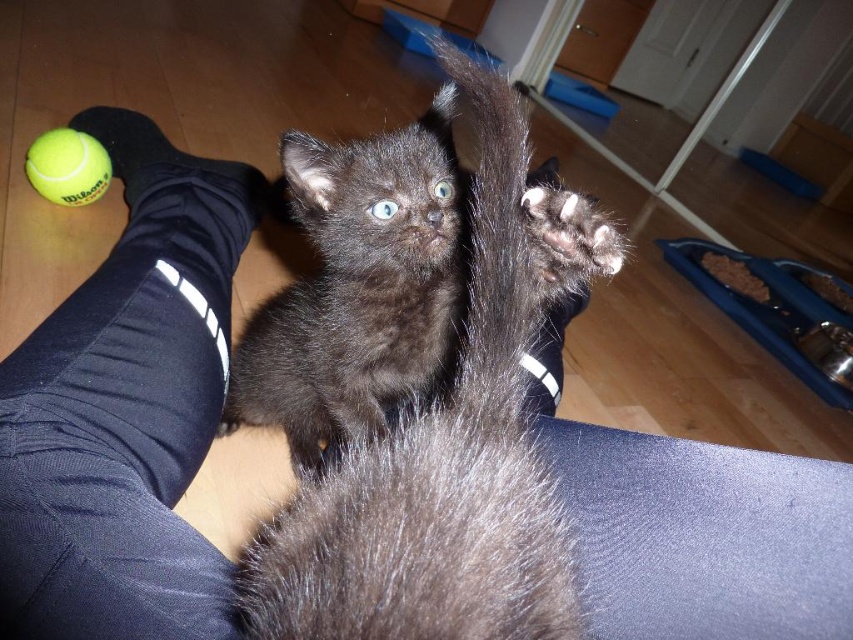
Question: Does black fur cat at center appear on the left side of green rubber tennis ball at lower left?

Choices:
 (A) no
 (B) yes

Answer: (A)

Question: Which object appears closest to the camera in this image?

Choices:
 (A) black fur cat at center
 (B) green rubber tennis ball at lower left

Answer: (A)

Question: Is black fur cat at center positioned behind green rubber tennis ball at lower left?

Choices:
 (A) no
 (B) yes

Answer: (A)

Question: Among these points, which one is farthest from the camera?

Choices:
 (A) [49, 188]
 (B) [448, 554]

Answer: (A)

Question: Is black fur cat at center to the left of green rubber tennis ball at lower left from the viewer's perspective?

Choices:
 (A) yes
 (B) no

Answer: (B)